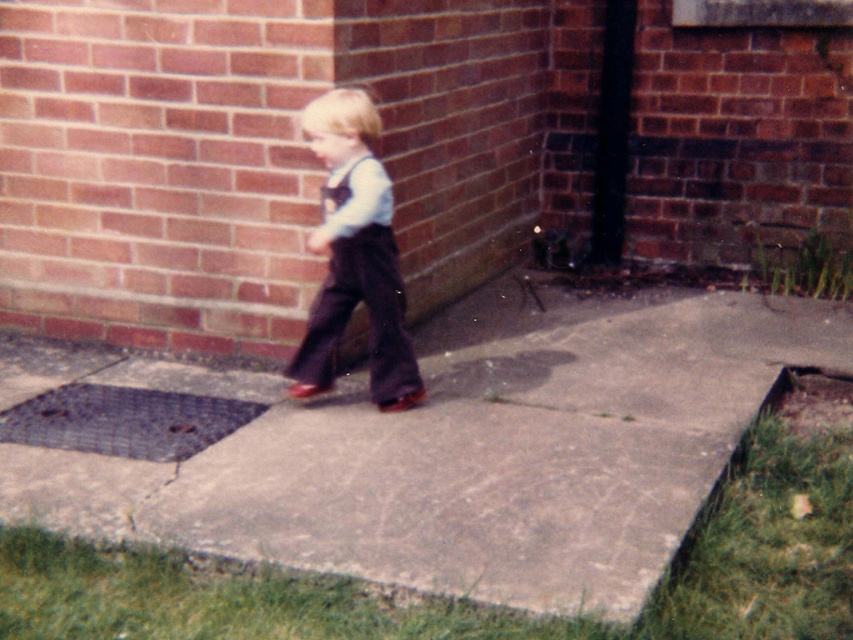
Between brown corduroy overalls at center and white fabric suspenders at center, which one has less height?

Standing shorter between the two is white fabric suspenders at center.

Who is more distant from viewer, (305, 131) or (331, 188)?

Positioned behind is point (305, 131).

This screenshot has width=853, height=640. What do you see at coordinates (354, 257) in the screenshot?
I see `brown corduroy overalls at center` at bounding box center [354, 257].

The height and width of the screenshot is (640, 853). What are the coordinates of `brown corduroy overalls at center` in the screenshot? It's located at (354, 257).

Between gray concrete at center and brown corduroy overalls at center, which one has more height?

With more height is brown corduroy overalls at center.

Which is behind, point (728, 298) or point (392, 269)?

Point (728, 298)

Where is `gray concrete at center`? Image resolution: width=853 pixels, height=640 pixels. gray concrete at center is located at coordinates (451, 445).

Can you confirm if gray concrete at center is positioned above white fabric suspenders at center?

No.

Does gray concrete at center have a greater width compared to white fabric suspenders at center?

Yes, gray concrete at center is wider than white fabric suspenders at center.

Is point (235, 394) farther from viewer compared to point (332, 173)?

Yes, it is.

In order to click on gray concrete at center in this screenshot , I will do `click(451, 445)`.